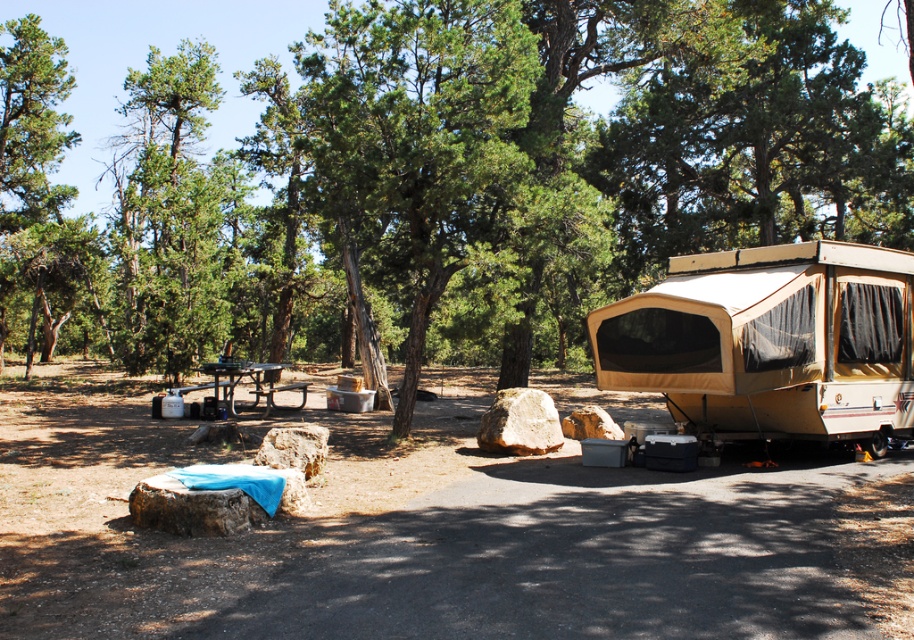
You are standing at the campsite and want to move from the point marked as point (x=688, y=291) to the point marked as point (x=232, y=394). Which direction should you move in relation to the camping gear?

Since point (x=688, y=291) is in front of point (x=232, y=394), you should move backward towards the camping gear to reach point (x=232, y=394).

Looking at this image, you are setting up a tent and need to decide where to place your gear. The tan fabric camper at right and the metallic picnic table at center are both in your way. Which object should you move to gain more space since it is shorter?

The metallic picnic table at center is shorter than the tan fabric camper at right, so you should move the metallic picnic table at center to gain more space.